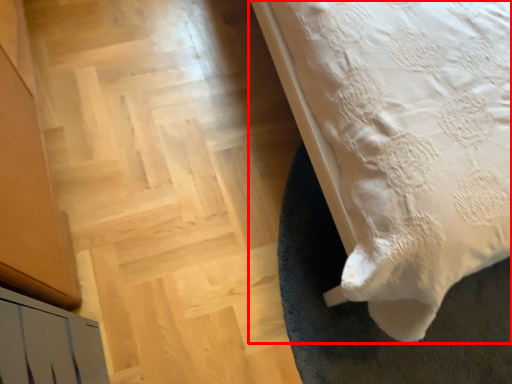
Question: Considering the relative positions of bed (annotated by the red box) and stairwell in the image provided, where is bed (annotated by the red box) located with respect to the staircase?

Choices:
 (A) right
 (B) left

Answer: (A)